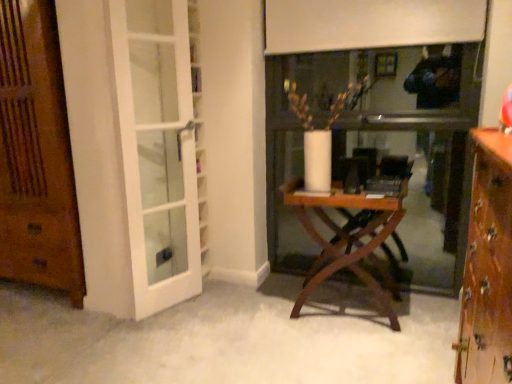
Image resolution: width=512 pixels, height=384 pixels. I want to click on vacant space in front of white glass door at left, so coord(166,335).